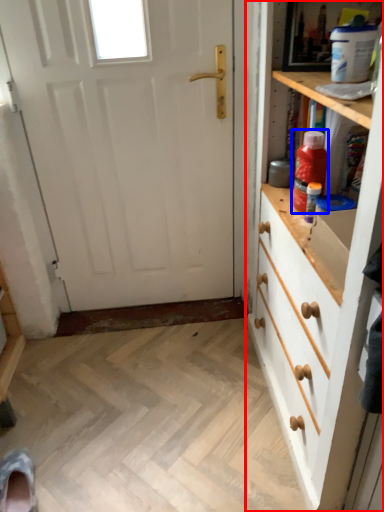
Question: Which object is closer to the camera taking this photo, chest of drawers (highlighted by a red box) or bottle (highlighted by a blue box)?

Choices:
 (A) chest of drawers
 (B) bottle

Answer: (A)